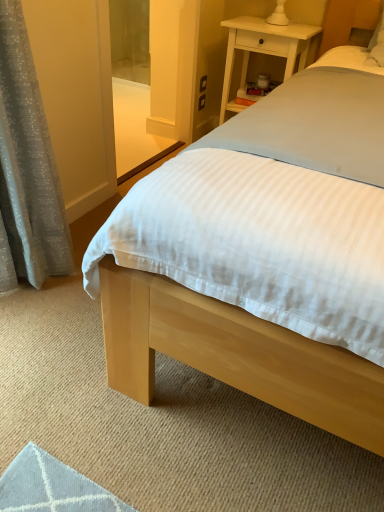
Locate an element on the screen. This screenshot has height=512, width=384. vacant space in front of gray textured curtain at left is located at coordinates (42, 348).